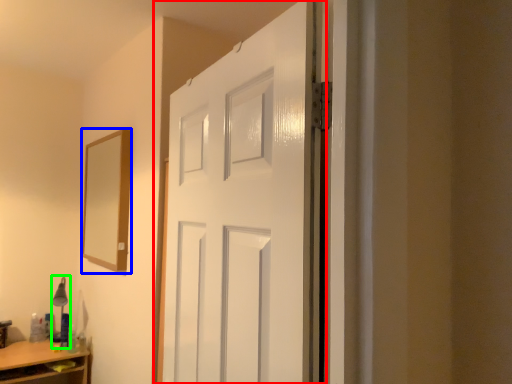
Question: Considering the real-world distances, which object is closest to door (highlighted by a red box)? mirror (highlighted by a blue box) or table lamp (highlighted by a green box).

Choices:
 (A) mirror
 (B) table lamp

Answer: (A)